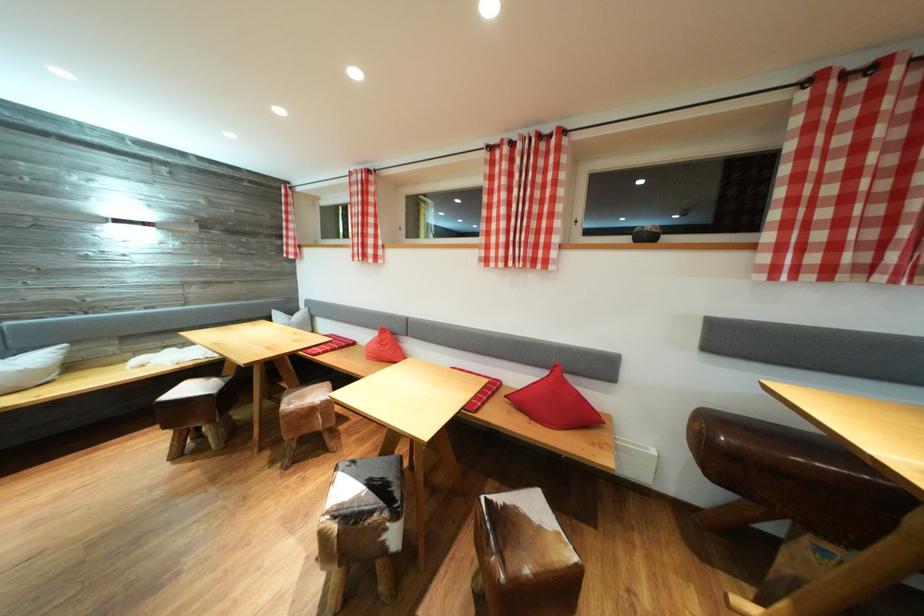
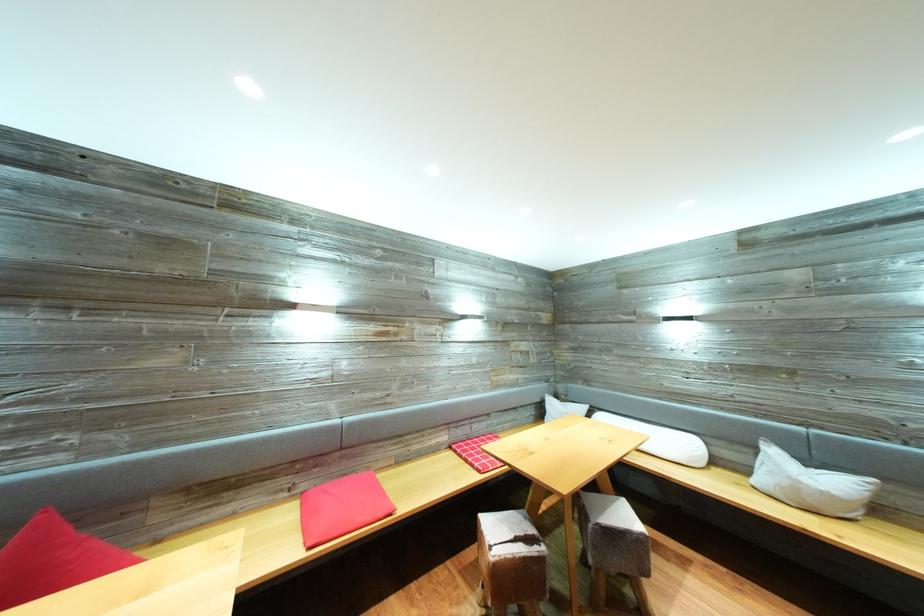
Question: The images are taken continuously from a first-person perspective. In which direction is your viewpoint rotating?

Choices:
 (A) Left
 (B) Right
 (C) Up
 (D) Down

Answer: (A)